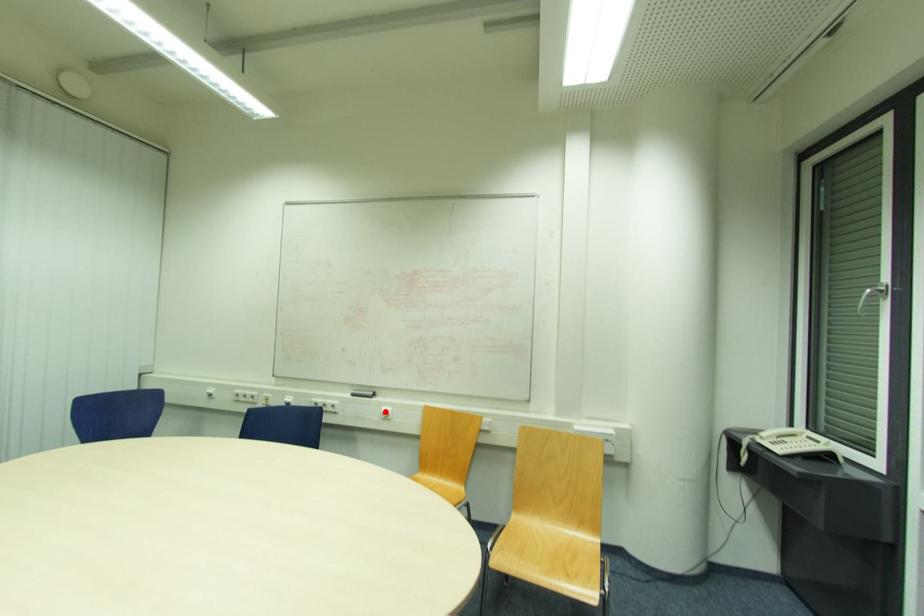
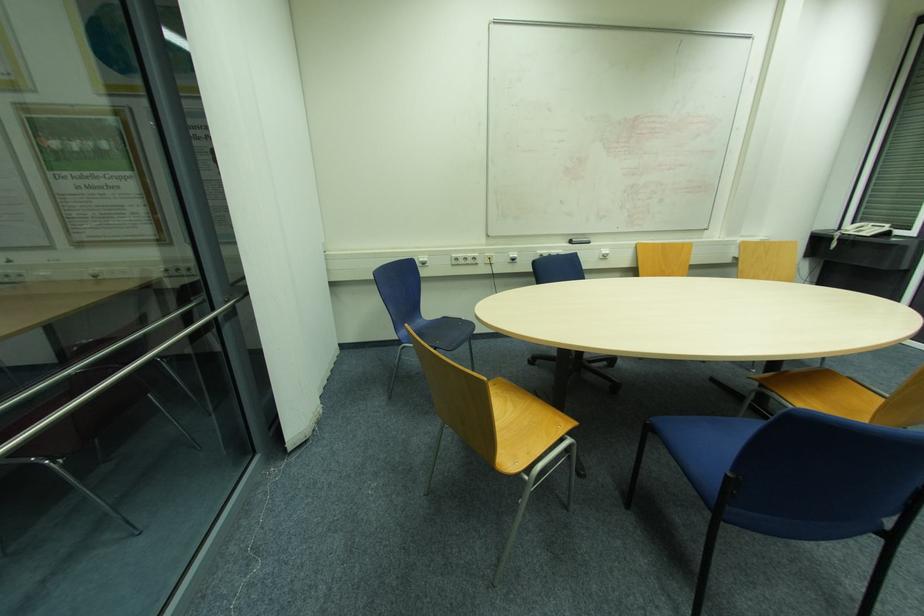
Question: I am providing you with two images of the same scene from different viewpoints. A red point is shown in image1. For the corresponding object point in image2, is it positioned nearer or farther from the camera?

Choices:
 (A) Nearer
 (B) Farther

Answer: (A)